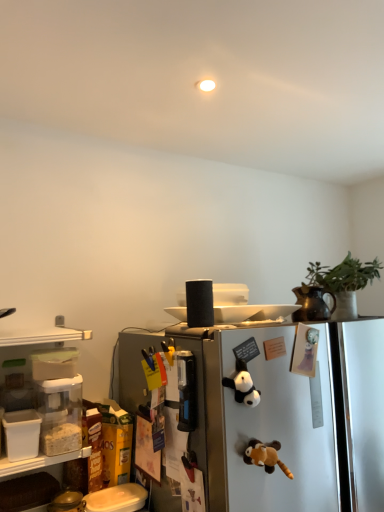
Question: Does point (264, 328) appear closer or farther from the camera than point (349, 280)?

Choices:
 (A) closer
 (B) farther

Answer: (A)

Question: In terms of width, does satin silver refrigerator at center look wider or thinner when compared to green matte plant at upper right?

Choices:
 (A) wide
 (B) thin

Answer: (A)

Question: Estimate the real-world distances between objects in this image. Which object is closer to the green matte plant at upper right?

Choices:
 (A) brown plush toy at center, marked as the second toy in a top-to-bottom arrangement
 (B) satin silver refrigerator at center
 (C) black plush panda at center, the 2th toy when ordered from bottom to top

Answer: (B)

Question: Which is nearer to the brown plush toy at center, the first toy in the bottom-to-top sequence?

Choices:
 (A) green matte plant at upper right
 (B) black plush panda at center, positioned as the first toy in top-to-bottom order
 (C) satin silver refrigerator at center

Answer: (B)